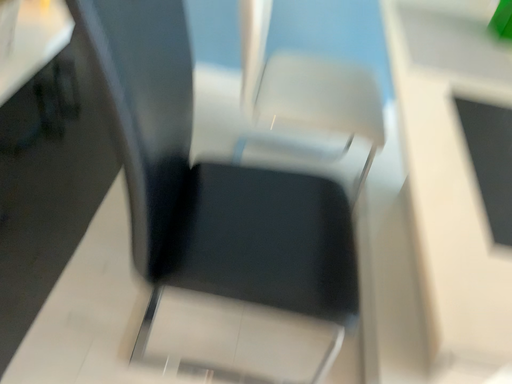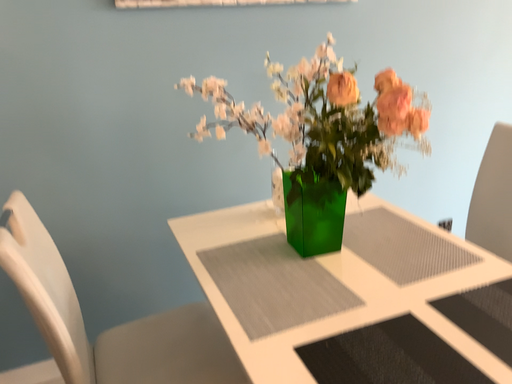
Question: Which way did the camera rotate in the video?

Choices:
 (A) rotated right
 (B) rotated left

Answer: (A)